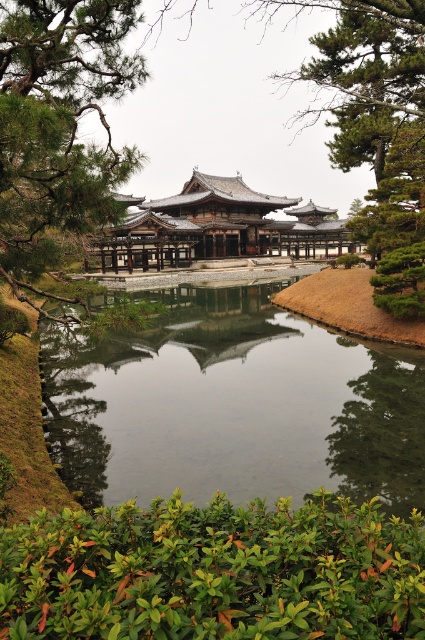
You are a visitor at the temple and want to walk from the green leafy bush at lower center to the clear water at center. How many steps would you need to take if each step covers 3 feet?

A: The distance between the green leafy bush at lower center and the clear water at center is 29.25 feet. Since each step covers 3 feet, dividing 29.25 by 3 gives approximately 9.75 steps. Therefore, you would need to take around 10 steps to reach the clear water at center from the green leafy bush at lower center.

You are a visitor standing in front of the temple and want to take a photo of both the clear water at center and the green leafy bush at lower center. Based on their positions, which object should you place on the left side of your camera frame to include both in the shot?

To include both the clear water at center and the green leafy bush at lower center in your photo, you should position the clear water at center on the left side of your camera frame since it is already on the left side of the green leafy bush at lower center.

You are standing in front of the temple and want to take a photo that includes the green textured pine tree at upper left. Based on its position, where should you aim your camera to ensure the tree is in the frame?

The green textured pine tree at upper left is located at coordinates approximately 0.192 on the x and 0.139 on the y axis, so you should aim your camera towards the upper left area of the scene to capture it in the frame.